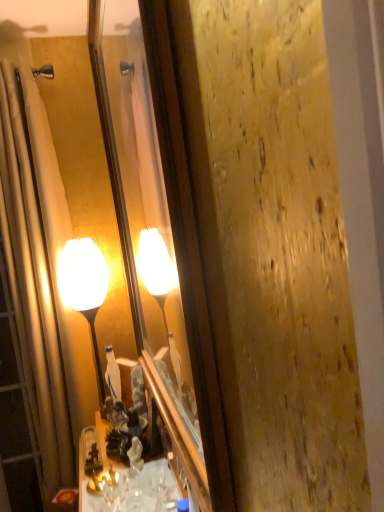
Question: From the image's perspective, does matte glass mirror at center appear lower than beige fabric shower curtain at left?

Choices:
 (A) no
 (B) yes

Answer: (A)

Question: From the image's perspective, is matte glass mirror at center above beige fabric shower curtain at left?

Choices:
 (A) no
 (B) yes

Answer: (B)

Question: Does matte glass mirror at center have a lesser height compared to beige fabric shower curtain at left?

Choices:
 (A) yes
 (B) no

Answer: (A)

Question: Are matte glass mirror at center and beige fabric shower curtain at left located far from each other?

Choices:
 (A) no
 (B) yes

Answer: (A)

Question: Does matte glass mirror at center have a greater width compared to beige fabric shower curtain at left?

Choices:
 (A) no
 (B) yes

Answer: (A)

Question: Is matte glass mirror at center facing towards beige fabric shower curtain at left?

Choices:
 (A) yes
 (B) no

Answer: (B)

Question: Is matte glass lamp at center turned away from shiny brass cabinet at lower center?

Choices:
 (A) no
 (B) yes

Answer: (A)

Question: Can you confirm if matte glass lamp at center is wider than shiny brass cabinet at lower center?

Choices:
 (A) yes
 (B) no

Answer: (B)

Question: Is shiny brass cabinet at lower center completely or partially inside matte glass lamp at center?

Choices:
 (A) no
 (B) yes

Answer: (A)

Question: Does matte glass lamp at center touch shiny brass cabinet at lower center?

Choices:
 (A) no
 (B) yes

Answer: (A)

Question: Can you confirm if matte glass lamp at center is positioned to the left of shiny brass cabinet at lower center?

Choices:
 (A) yes
 (B) no

Answer: (A)

Question: From the image's perspective, would you say matte glass lamp at center is shown under shiny brass cabinet at lower center?

Choices:
 (A) yes
 (B) no

Answer: (B)

Question: Is shiny brass cabinet at lower center facing away from matte glass lamp at center?

Choices:
 (A) no
 (B) yes

Answer: (A)